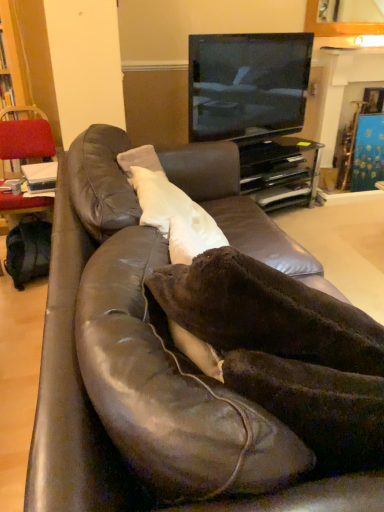
Question: From their relative heights in the image, would you say black glossy tv at upper center is taller or shorter than velvet red chair at left?

Choices:
 (A) tall
 (B) short

Answer: (B)

Question: Relative to velvet red chair at left, is black glossy tv at upper center in front or behind?

Choices:
 (A) front
 (B) behind

Answer: (B)

Question: Which object is positioned farthest from the brown leather couch at center?

Choices:
 (A) velvet red chair at left
 (B) white soft pillow at center
 (C) black glossy tv at upper center
 (D) black glossy entertainment center at upper center
 (E) metallic gold fireplace at upper center

Answer: (E)

Question: Estimate the real-world distances between objects in this image. Which object is closer to the black glossy tv at upper center?

Choices:
 (A) metallic gold fireplace at upper center
 (B) velvet red chair at left
 (C) brown leather couch at center
 (D) black glossy entertainment center at upper center
 (E) white soft pillow at center

Answer: (D)